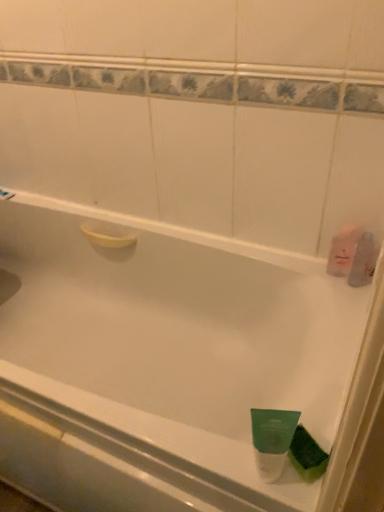
Question: Is the position of pink translucent bottle at right, which is the 1th mouthwash in top-to-bottom order, more distant than that of white glossy shower at upper left?

Choices:
 (A) yes
 (B) no

Answer: (B)

Question: From a real-world perspective, is pink translucent bottle at right, which is the third mouthwash from left to right, on top of white glossy shower at upper left?

Choices:
 (A) no
 (B) yes

Answer: (B)

Question: Can you confirm if pink translucent bottle at right, which is the 1th mouthwash in top-to-bottom order, is thinner than white glossy shower at upper left?

Choices:
 (A) no
 (B) yes

Answer: (B)

Question: Could you tell me if pink translucent bottle at right, which is the 1th mouthwash in top-to-bottom order, is facing white glossy shower at upper left?

Choices:
 (A) no
 (B) yes

Answer: (A)

Question: Can you confirm if pink translucent bottle at right, placed as the fourth mouthwash when sorted from bottom to top, is wider than white glossy shower at upper left?

Choices:
 (A) yes
 (B) no

Answer: (B)

Question: In the image, is green matte tube at bottom right, arranged as the 4th mouthwash when viewed from the right, positioned in front of or behind green matte mouthwash at bottom right, the 4th mouthwash from the top?

Choices:
 (A) behind
 (B) front

Answer: (B)

Question: From a real-world perspective, is green matte tube at bottom right, arranged as the 4th mouthwash when viewed from the right, physically located above or below green matte mouthwash at bottom right, the 2th mouthwash viewed from the left?

Choices:
 (A) above
 (B) below

Answer: (A)

Question: Based on their positions, is green matte tube at bottom right, which appears as the first mouthwash when viewed from the front, located to the left or right of green matte mouthwash at bottom right, the first mouthwash when ordered from bottom to top?

Choices:
 (A) left
 (B) right

Answer: (A)

Question: Looking at their shapes, would you say green matte tube at bottom right, arranged as the 4th mouthwash when viewed from the right, is wider or thinner than green matte mouthwash at bottom right, the 4th mouthwash from the top?

Choices:
 (A) wide
 (B) thin

Answer: (B)

Question: In the image, is green matte mouthwash at bottom right, marked as the third mouthwash in a back-to-front arrangement, on the left side or the right side of green matte tube at bottom right, which is the 2th mouthwash in bottom-to-top order?

Choices:
 (A) right
 (B) left

Answer: (A)

Question: From the image's perspective, is green matte mouthwash at bottom right, the first mouthwash when ordered from bottom to top, located above or below green matte tube at bottom right, arranged as the 4th mouthwash when viewed from the right?

Choices:
 (A) above
 (B) below

Answer: (B)

Question: Is point (316, 470) closer or farther from the camera than point (281, 450)?

Choices:
 (A) farther
 (B) closer

Answer: (A)

Question: Considering their positions, is green matte mouthwash at bottom right, the first mouthwash when ordered from bottom to top, located in front of or behind green matte tube at bottom right, placed as the first mouthwash when sorted from left to right?

Choices:
 (A) front
 (B) behind

Answer: (B)

Question: From a real-world perspective, relative to white glossy shower at upper left, is clear plastic bottle at right, the fourth mouthwash viewed from the left, vertically above or below?

Choices:
 (A) below
 (B) above

Answer: (B)

Question: In terms of size, does clear plastic bottle at right, the 3th mouthwash when ordered from front to back, appear bigger or smaller than white glossy shower at upper left?

Choices:
 (A) small
 (B) big

Answer: (B)